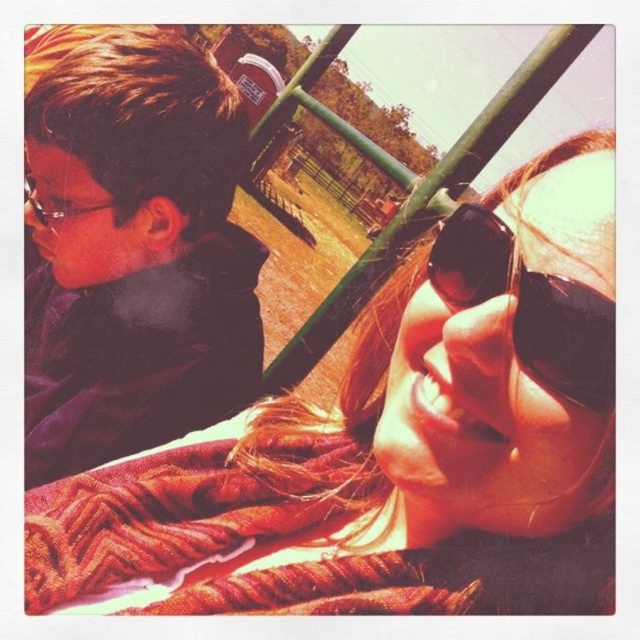
Question: Does textured orange blanket at lower left have a larger size compared to matte black jacket at left?

Choices:
 (A) no
 (B) yes

Answer: (A)

Question: Which point appears closest to the camera in this image?

Choices:
 (A) (189, 451)
 (B) (230, 560)
 (C) (88, 460)

Answer: (B)

Question: Can you confirm if knitted wool scarf at lower center is positioned to the left of black reflective sunglasses at upper right?

Choices:
 (A) yes
 (B) no

Answer: (A)

Question: Among these objects, which one is nearest to the camera?

Choices:
 (A) black reflective sunglasses at upper right
 (B) knitted wool scarf at lower center
 (C) textured orange blanket at lower left
 (D) matte black jacket at left

Answer: (A)

Question: Which point is closer to the camera?

Choices:
 (A) textured orange blanket at lower left
 (B) black reflective sunglasses at upper right

Answer: (B)

Question: Is textured orange blanket at lower left wider than matte black jacket at left?

Choices:
 (A) yes
 (B) no

Answer: (B)